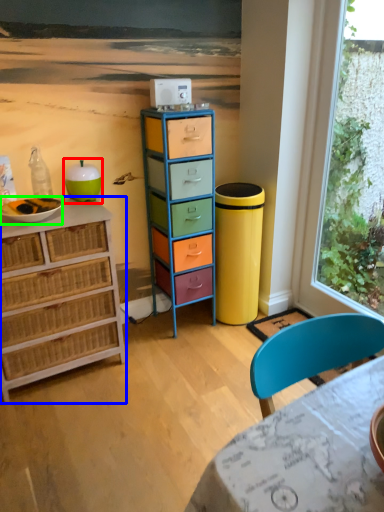
Question: Based on their relative distances, which object is nearer to teal (highlighted by a red box)? Choose from chest of drawers (highlighted by a blue box) and bowl (highlighted by a green box).

Choices:
 (A) chest of drawers
 (B) bowl

Answer: (B)